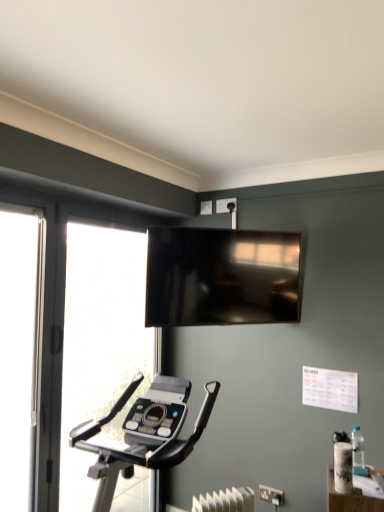
Question: Are white plastic electric outlet at center, the 2th electric outlet positioned from the top, and matte black tv at upper center far apart?

Choices:
 (A) no
 (B) yes

Answer: (B)

Question: From a real-world perspective, is white plastic electric outlet at center, the first electric outlet positioned from the right, positioned over matte black tv at upper center based on gravity?

Choices:
 (A) yes
 (B) no

Answer: (B)

Question: Is white plastic electric outlet at center, acting as the first electric outlet starting from the bottom, to the left of matte black tv at upper center from the viewer's perspective?

Choices:
 (A) no
 (B) yes

Answer: (A)

Question: Is matte black tv at upper center surrounded by white plastic electric outlet at center, the second electric outlet viewed from the back?

Choices:
 (A) no
 (B) yes

Answer: (A)

Question: Considering the relative sizes of white plastic electric outlet at center, the first electric outlet positioned from the right, and matte black tv at upper center in the image provided, is white plastic electric outlet at center, the first electric outlet positioned from the right, shorter than matte black tv at upper center?

Choices:
 (A) yes
 (B) no

Answer: (A)

Question: From a real-world perspective, is white plastic electric outlet at center, the second electric outlet viewed from the back, positioned under matte black tv at upper center based on gravity?

Choices:
 (A) no
 (B) yes

Answer: (B)

Question: Does white plastic electric outlet at upper center, which appears as the 2th electric outlet when viewed from the front, appear on the right side of transparent glass screen door at left?

Choices:
 (A) no
 (B) yes

Answer: (B)

Question: From a real-world perspective, is white plastic electric outlet at upper center, which is the 2th electric outlet from right to left, located beneath transparent glass screen door at left?

Choices:
 (A) no
 (B) yes

Answer: (A)

Question: Does white plastic electric outlet at upper center, which is the 2th electric outlet from right to left, touch transparent glass screen door at left?

Choices:
 (A) no
 (B) yes

Answer: (A)

Question: Is white plastic electric outlet at upper center, which appears as the 2th electric outlet when viewed from the front, at the left side of transparent glass screen door at left?

Choices:
 (A) no
 (B) yes

Answer: (A)

Question: Is white plastic electric outlet at upper center, which appears as the 1th electric outlet when viewed from the top, positioned behind transparent glass screen door at left?

Choices:
 (A) no
 (B) yes

Answer: (B)

Question: Is white plastic electric outlet at upper center, which is the 2th electric outlet from right to left, aimed at transparent glass screen door at left?

Choices:
 (A) yes
 (B) no

Answer: (B)

Question: Considering the relative positions of transparent glass screen door at left and transparent glass window at left in the image provided, is transparent glass screen door at left to the right of transparent glass window at left from the viewer's perspective?

Choices:
 (A) no
 (B) yes

Answer: (A)